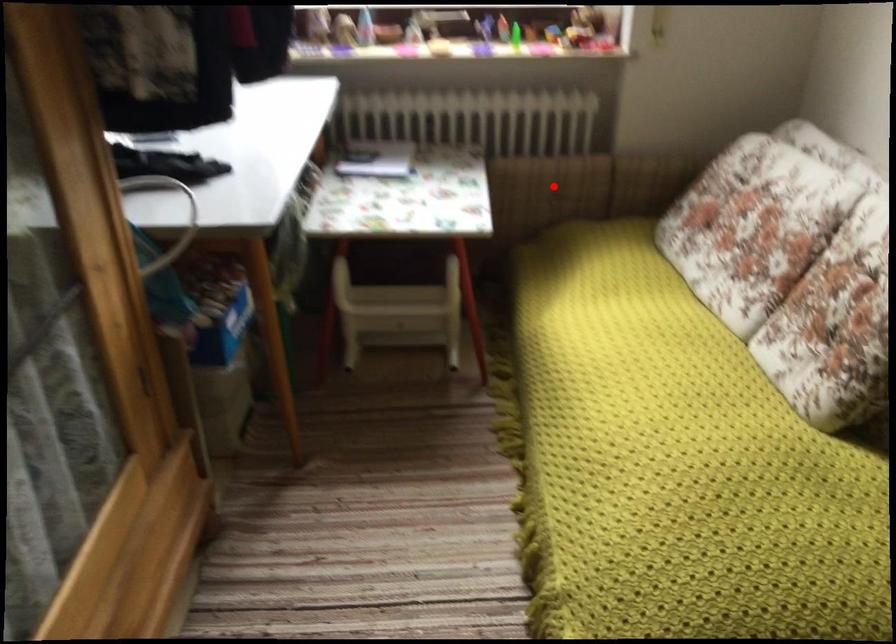
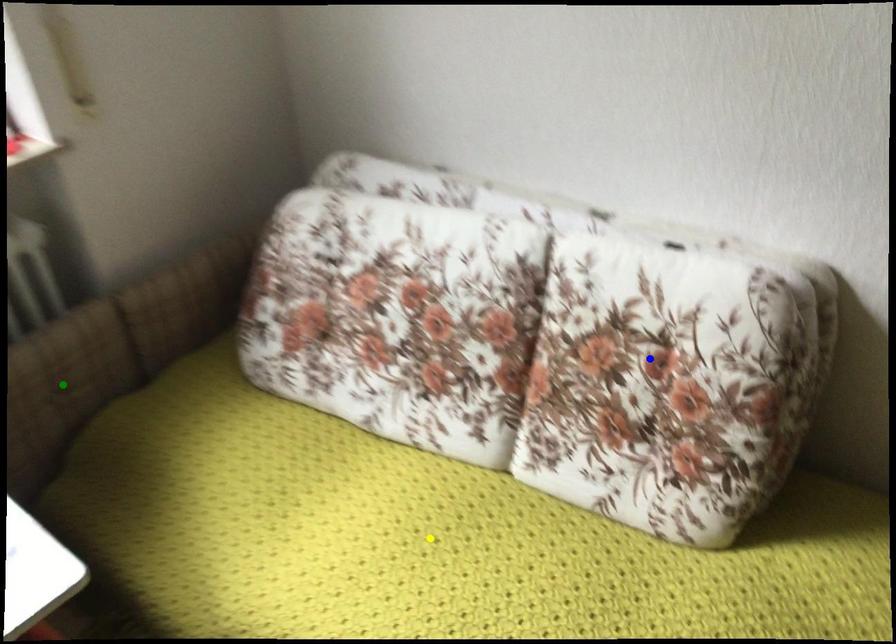
Question: I am providing you with two images of the same scene from different viewpoints. A red point is marked on the first image. You are given multiple points on the second image. Which point in image 2 is actually the same real-world point as the red point in image 1?

Choices:
 (A) green point
 (B) blue point
 (C) yellow point

Answer: (A)